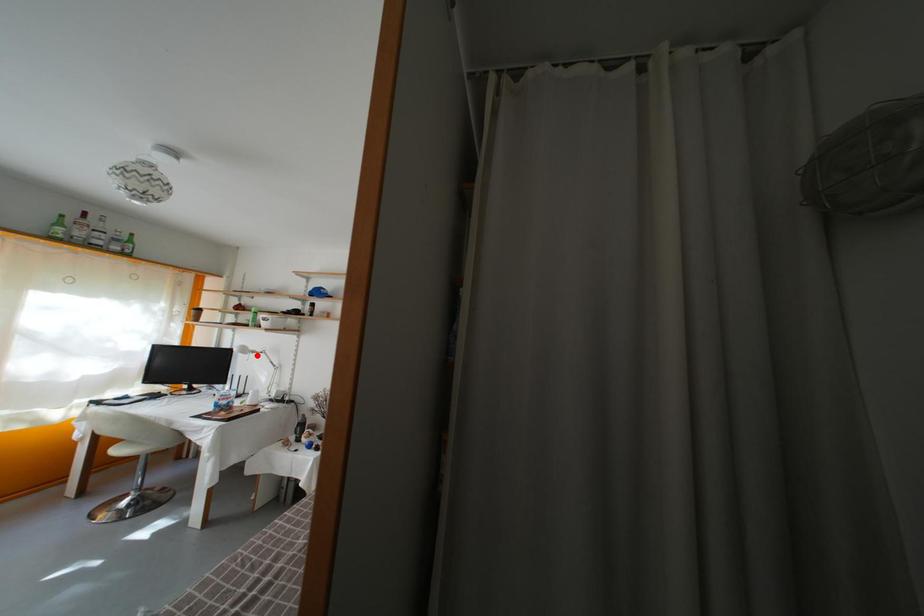
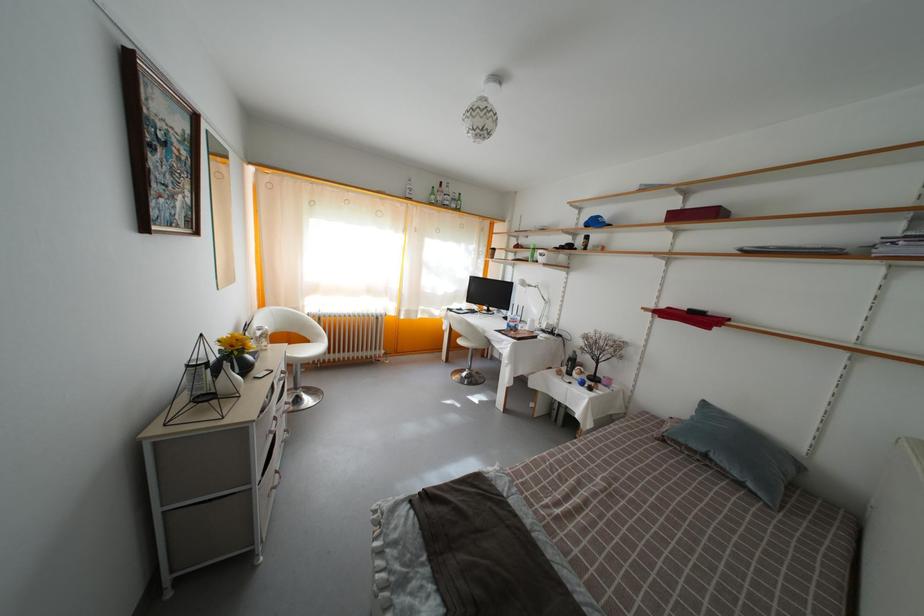
Find the pixel in the second image that matches the highlighted location in the first image.

(533, 289)